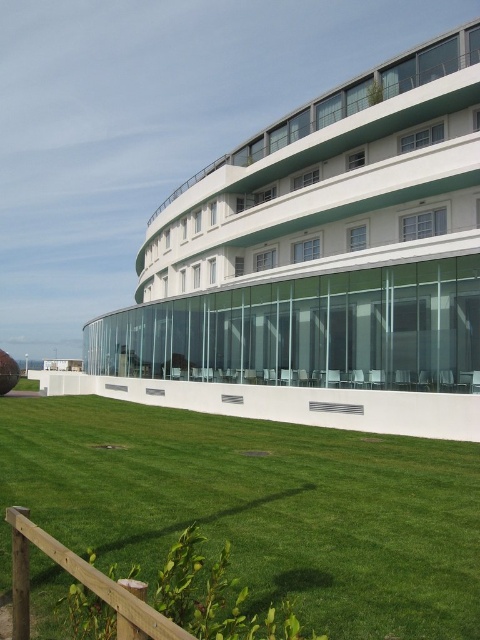
You are standing in front of the modern architectural structure and want to determine the relative positions of two points on its facade. Given that you can see both points, which point is closer to you, point 1 at coordinates point (227, 403) or point 2 at coordinates point (29, 435)?

Point 2 at coordinates point (29, 435) is closer to you because point 1 at coordinates point (227, 403) is further to the camera than point (29, 435).

You are standing at point [324,257] in the image. What object are you directly facing?

You are directly facing the white glass building at center located at point [324,257].

You are standing in front of a modern architectural structure. You see the white glass building at center and the green grass at lower center. Which object is located to the left of the other?

The white glass building at center is positioned on the left side of green grass at lower center.